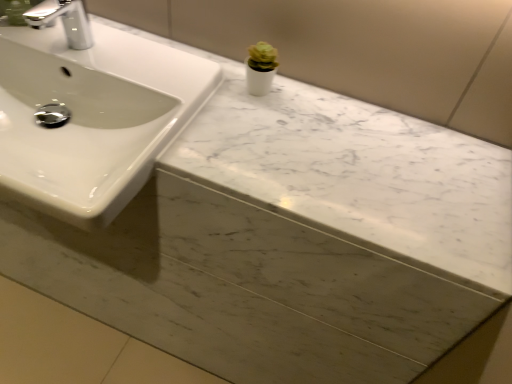
Locate an element on the screen. The height and width of the screenshot is (384, 512). vacant space to the left of silver metallic faucet at upper left is located at coordinates (25, 31).